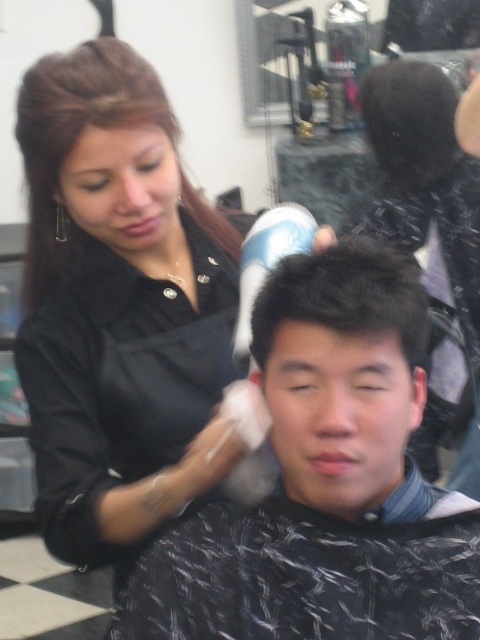
In the hair salon scene, you notice two black matte items. The first is the black matte hairdryer at upper center and the second is the black matte hair clip at upper left. Which one is positioned more to the right?

The black matte hairdryer at upper center is positioned more to the right than the black matte hair clip at upper left.

You are a customer in the salon and want to know which object is closer to the ceiling. Based on the scene, which one is higher between the black matte hairdryer at upper center and the black matte hair clip at upper left?

The black matte hair clip at upper left is higher than the black matte hairdryer at upper center because the hairdryer is positioned under the hair clip.

You are a customer in the salon and want to know if the black matte hairdryer at upper center is closer to you than the black matte hair clip at upper left. Can you tell based on the scene?

The black matte hairdryer at upper center is in front of the black matte hair clip at upper left, so yes, it is closer to you.